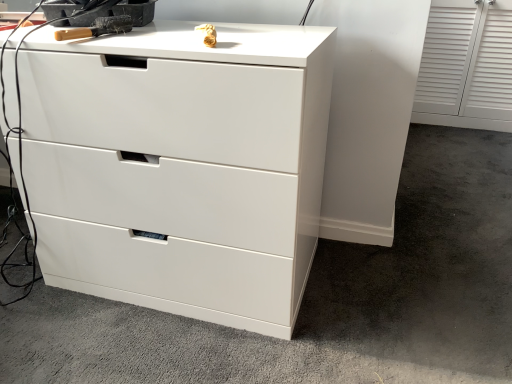
Where is `free space to the left of wooden-handled brush at upper left`? free space to the left of wooden-handled brush at upper left is located at coordinates (38, 33).